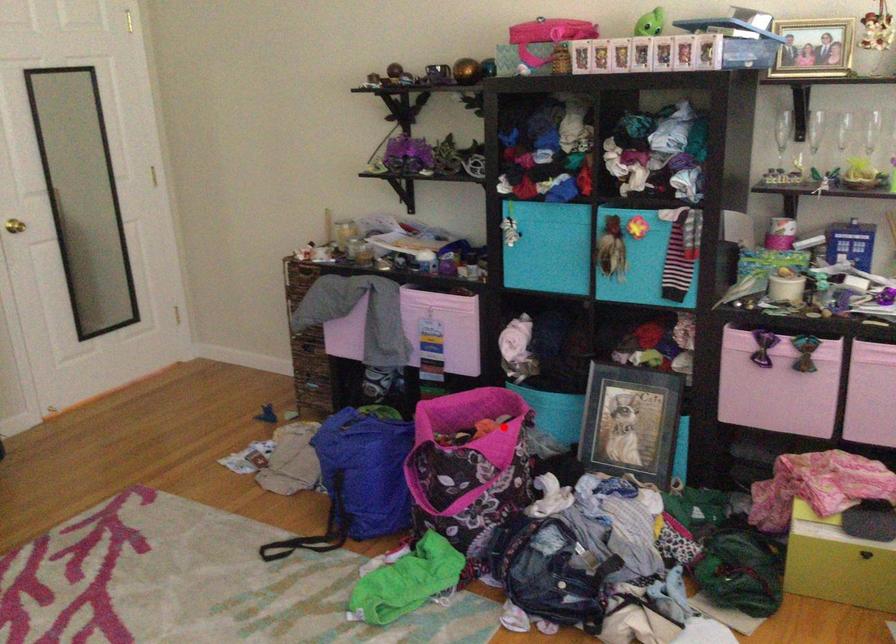
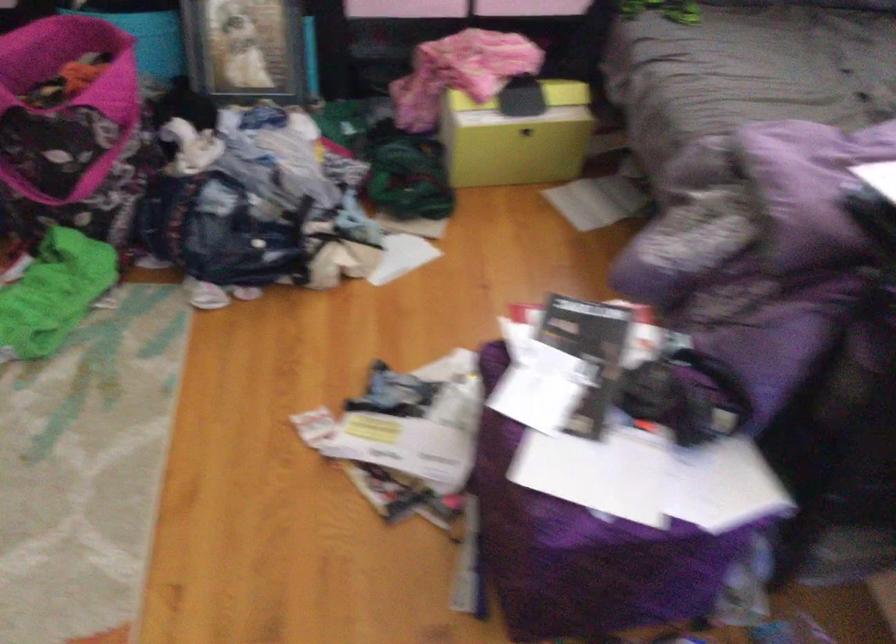
Question: I am providing you with two images of the same scene from different viewpoints. A red point is shown in image1. For the corresponding object point in image2, is it positioned nearer or farther from the camera?

Choices:
 (A) Nearer
 (B) Farther

Answer: (A)